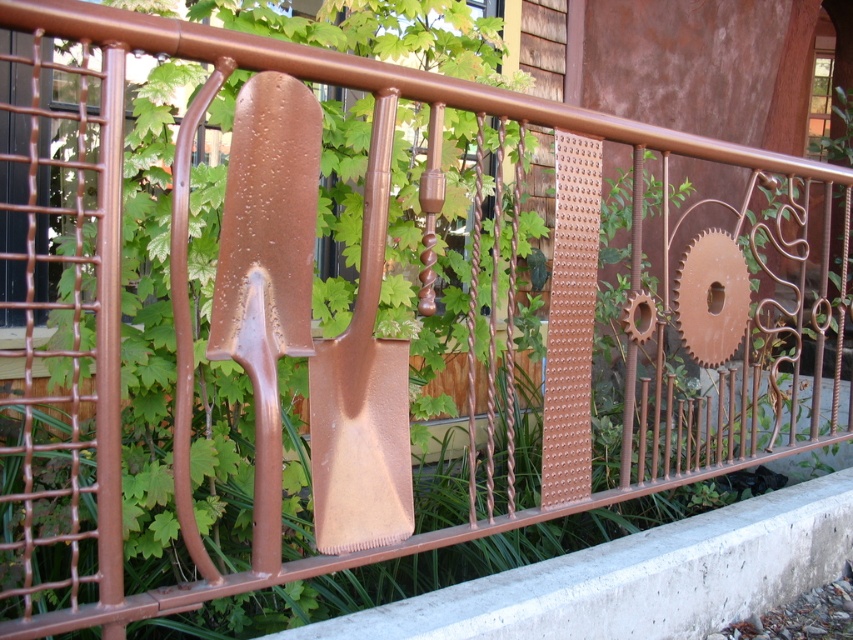
Question: Among these points, which one is nearest to the camera?

Choices:
 (A) (345, 355)
 (B) (242, 156)

Answer: (B)

Question: Which point is closer to the camera?

Choices:
 (A) (328, 403)
 (B) (276, 211)

Answer: (B)

Question: Is rusty metal shovel at center above brown matte shovel at center?

Choices:
 (A) no
 (B) yes

Answer: (A)

Question: In this image, where is rusty metal shovel at center located relative to brown matte shovel at center?

Choices:
 (A) above
 (B) below

Answer: (B)

Question: Among these points, which one is nearest to the camera?

Choices:
 (A) (367, 532)
 (B) (312, 147)

Answer: (B)

Question: Is rusty metal shovel at center smaller than brown matte shovel at center?

Choices:
 (A) yes
 (B) no

Answer: (B)